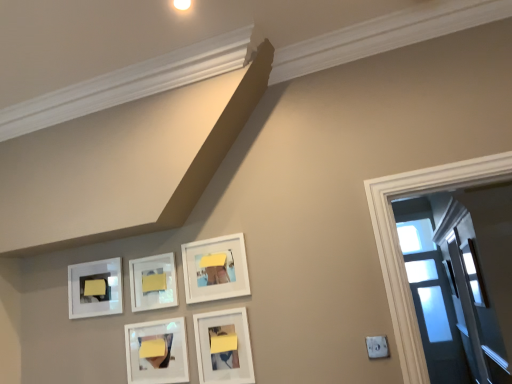
Question: Is white matte picture frame at center, positioned as the 2th picture frame in left-to-right order, further to camera compared to matte white picture frame at lower center, the 3th picture frame when ordered from left to right?

Choices:
 (A) yes
 (B) no

Answer: (A)

Question: Does white matte picture frame at center, the fourth picture frame when ordered from right to left, have a smaller size compared to matte white picture frame at lower center, the 3th picture frame when ordered from left to right?

Choices:
 (A) no
 (B) yes

Answer: (B)

Question: Is white matte picture frame at center, the fourth picture frame when ordered from right to left, oriented towards matte white picture frame at lower center, the 3th picture frame when ordered from left to right?

Choices:
 (A) yes
 (B) no

Answer: (B)

Question: Does white matte picture frame at center, the fourth picture frame when ordered from right to left, have a lesser height compared to matte white picture frame at lower center, the 3th picture frame when ordered from left to right?

Choices:
 (A) yes
 (B) no

Answer: (A)

Question: Can you confirm if white matte picture frame at center, positioned as the 2th picture frame in left-to-right order, is thinner than matte white picture frame at lower center, which appears as the 3th picture frame when viewed from the right?

Choices:
 (A) yes
 (B) no

Answer: (A)

Question: Is white matte picture frame at center, positioned as the 2th picture frame in left-to-right order, far away from matte white picture frame at lower center, which appears as the 3th picture frame when viewed from the right?

Choices:
 (A) no
 (B) yes

Answer: (A)

Question: Does matte white picture frame at lower center, the fifth picture frame when ordered from left to right, have a greater width compared to matte yellow paper at upper left, positioned as the first furniture in back-to-front order?

Choices:
 (A) yes
 (B) no

Answer: (A)

Question: From the image's perspective, does matte white picture frame at lower center, which is counted as the first picture frame, starting from the right, appear higher than matte yellow paper at upper left, positioned as the first furniture in back-to-front order?

Choices:
 (A) yes
 (B) no

Answer: (B)

Question: From the image's perspective, is matte white picture frame at lower center, the fifth picture frame when ordered from left to right, under matte yellow paper at upper left, which is the 2th furniture in front-to-back order?

Choices:
 (A) yes
 (B) no

Answer: (A)

Question: From a real-world perspective, does matte white picture frame at lower center, which is counted as the first picture frame, starting from the right, sit lower than matte yellow paper at upper left, which ranks as the 2th furniture in right-to-left order?

Choices:
 (A) yes
 (B) no

Answer: (A)

Question: Can you confirm if matte white picture frame at lower center, the fifth picture frame when ordered from left to right, is positioned to the left of matte yellow paper at upper left, which ranks as the 2th furniture in right-to-left order?

Choices:
 (A) no
 (B) yes

Answer: (A)

Question: Can you confirm if matte white picture frame at lower center, the fifth picture frame when ordered from left to right, is bigger than matte yellow paper at upper left, positioned as the first furniture in back-to-front order?

Choices:
 (A) yes
 (B) no

Answer: (A)

Question: From a real-world perspective, is white matte picture frame at upper left, the 1th picture frame positioned from the left, under matte yellow paper at upper left, positioned as the first furniture in back-to-front order?

Choices:
 (A) yes
 (B) no

Answer: (A)